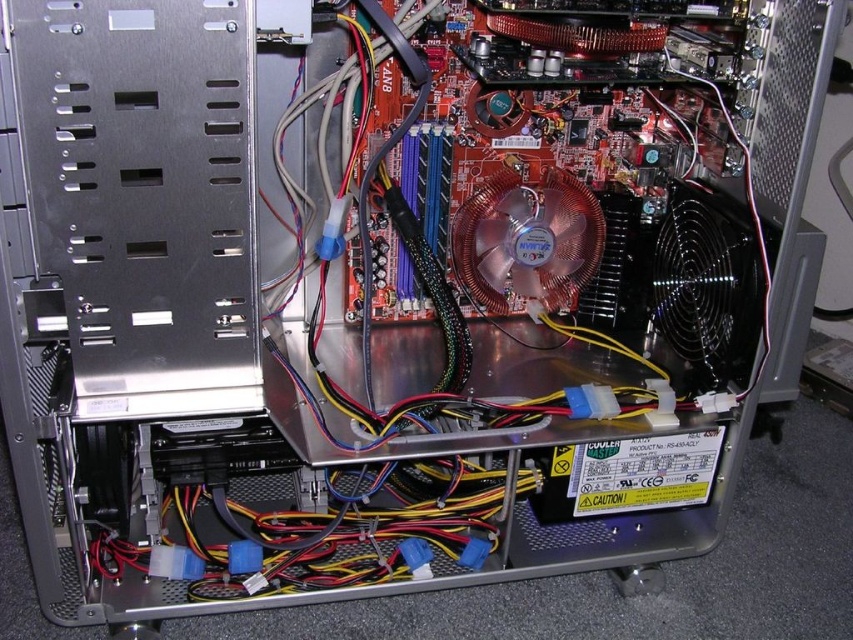
You are a technician inspecting the computer case. You notice two points labeled as point 1 and point 2. Point 1 is at coordinates (680, 200) and point 2 is at (486, 204). From your perspective, which point is closer to you?

Point 1 at coordinates (680, 200) is closer to you because it is in front of point 2 at (486, 204).

You are a technician working on a computer. You need to replace one of the cooling fans. The fan you want to replace is located at point [735,240]. The replacement fan is 1.2 meters in diameter. Will the new fan fit in the space between the two existing fans?

The two existing cooling fans are 1.21 meters apart. The replacement fan is 1.2 meters in diameter, so it will fit in the space between them since the distance between the existing fans is slightly larger than the diameter of the new fan.